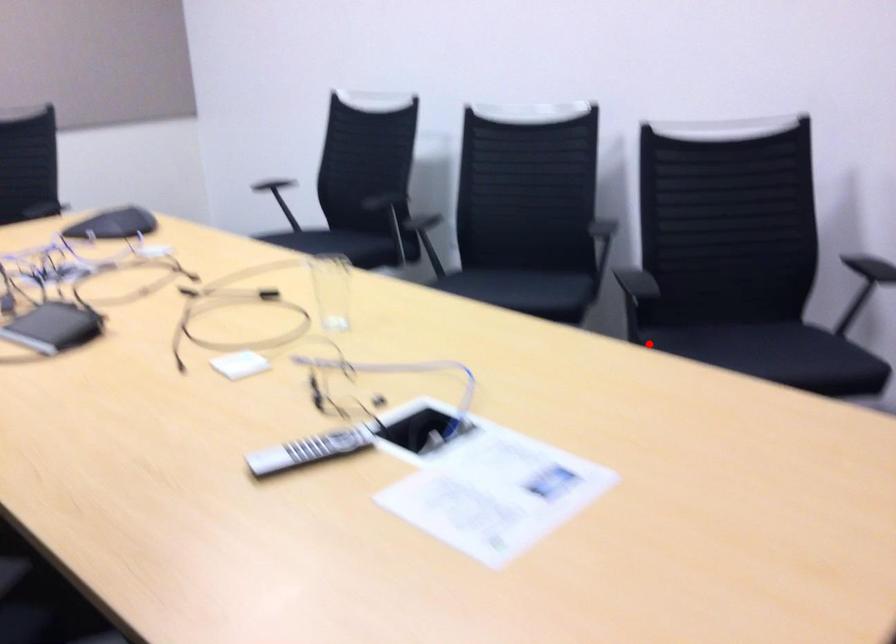
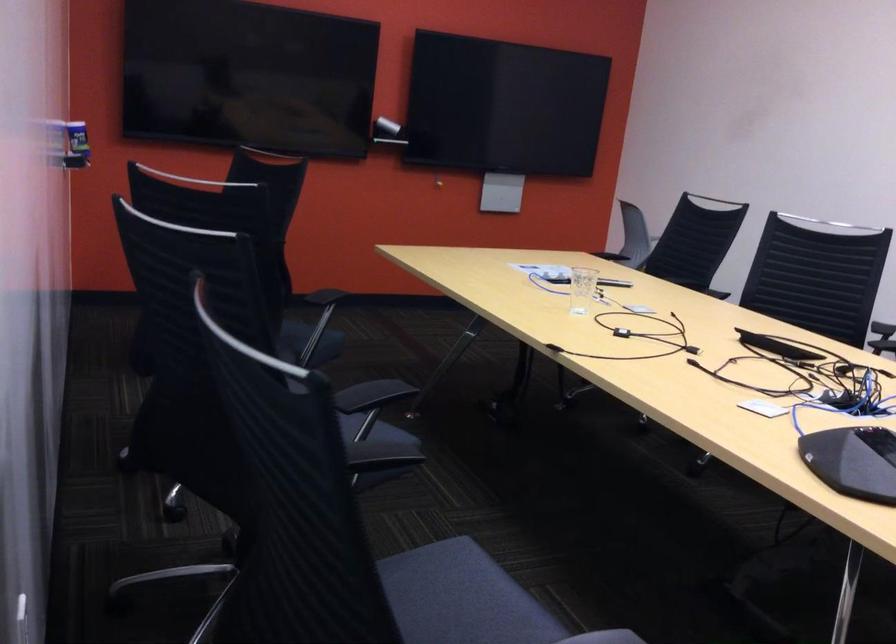
Question: A red point is marked in image1. In image2, is the corresponding 3D point closer to the camera or farther? Reply with the corresponding letter.

Choices:
 (A) The corresponding 3D point is closer.
 (B) The corresponding 3D point is farther.

Answer: (B)